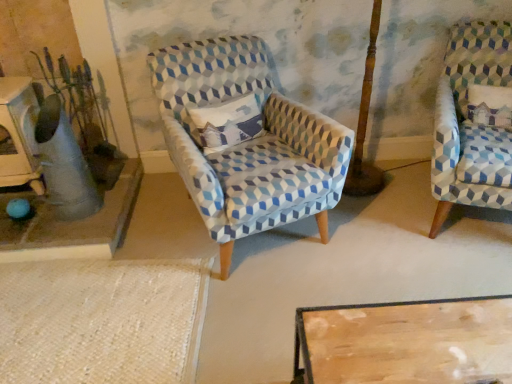
You are a GUI agent. You are given a task and a screenshot of the screen. Output one action in this format:
    pyautogui.click(x=<x>, y=<y>)
    Task: Click on the free space to the right of blue patterned fabric chair at center, acting as the 1th chair starting from the left
    The width and height of the screenshot is (512, 384).
    Given the screenshot: What is the action you would take?
    pyautogui.click(x=394, y=248)